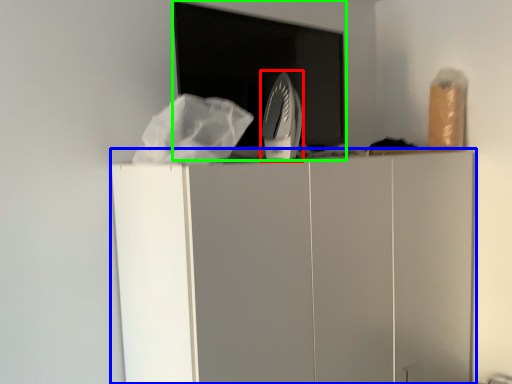
Question: Considering the real-world distances, which object is farthest from home appliance (highlighted by a red box)? furniture (highlighted by a blue box) or appliance (highlighted by a green box)?

Choices:
 (A) furniture
 (B) appliance

Answer: (A)